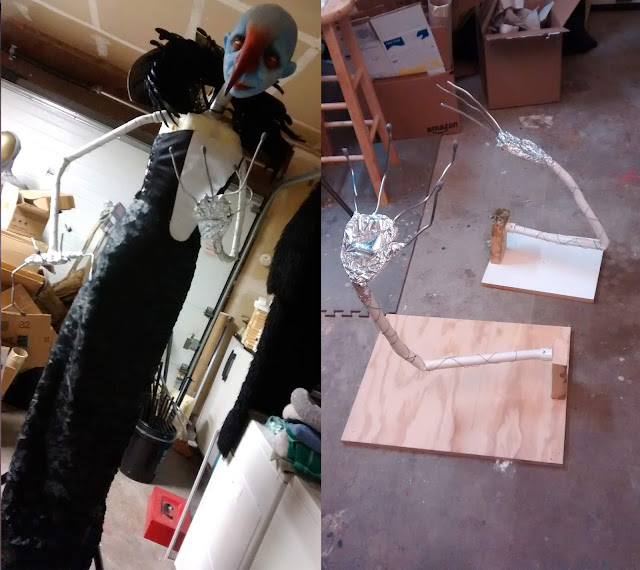
At what (x,y) coordinates should I click in order to perform the action: click on creepy statue. Please return your answer as a coordinate pair (x, y). The image size is (640, 570). Looking at the image, I should click on (208, 142).